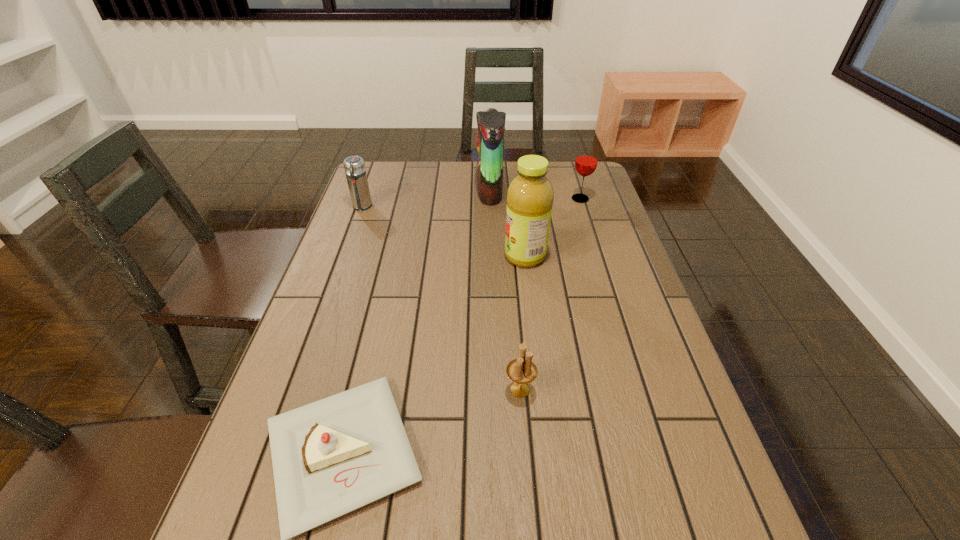
This screenshot has width=960, height=540. What are the coordinates of `free location at the left edge` in the screenshot? It's located at (318, 330).

Where is `vacant space at the right edge`? vacant space at the right edge is located at coordinates (642, 399).

In the image, there is a desktop. At what (x,y) coordinates should I click in order to perform the action: click on vacant space at the far left corner. Please return your answer as a coordinate pair (x, y). The height and width of the screenshot is (540, 960). Looking at the image, I should click on (402, 195).

Where is `free space between the thermos bottle and the parrot`? The height and width of the screenshot is (540, 960). free space between the thermos bottle and the parrot is located at coordinates (425, 199).

At what (x,y) coordinates should I click in order to perform the action: click on vacant space that is in between the fourth farthest object and the thermos bottle. Please return your answer as a coordinate pair (x, y). Image resolution: width=960 pixels, height=540 pixels. Looking at the image, I should click on (444, 232).

This screenshot has width=960, height=540. I want to click on free space between the thermos bottle and the fourth farthest object, so click(x=444, y=232).

In order to click on blank region between the fourth farthest object and the rightmost object in this screenshot , I will do `click(553, 227)`.

Where is `vacant space that is in between the parrot and the candle holder`? Image resolution: width=960 pixels, height=540 pixels. vacant space that is in between the parrot and the candle holder is located at coordinates (505, 291).

Where is `object identified as the fourth closest to the rightmost object`? This screenshot has width=960, height=540. object identified as the fourth closest to the rightmost object is located at coordinates (522, 370).

Point out which object is positioned as the fifth nearest to the thermos bottle. Please provide its 2D coordinates. Your answer should be formatted as a tuple, i.e. [(x, y)], where the tuple contains the x and y coordinates of a point satisfying the conditions above.

[(522, 370)]